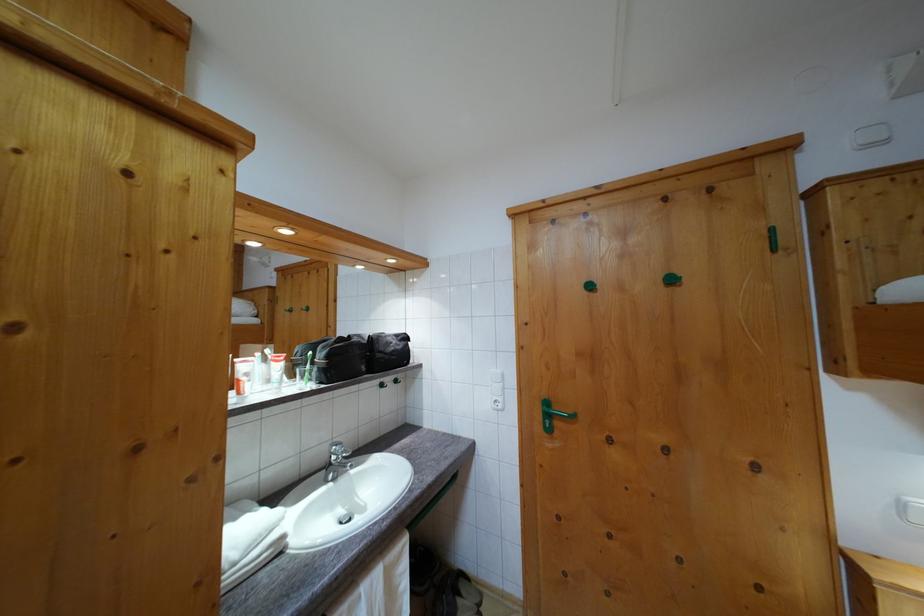
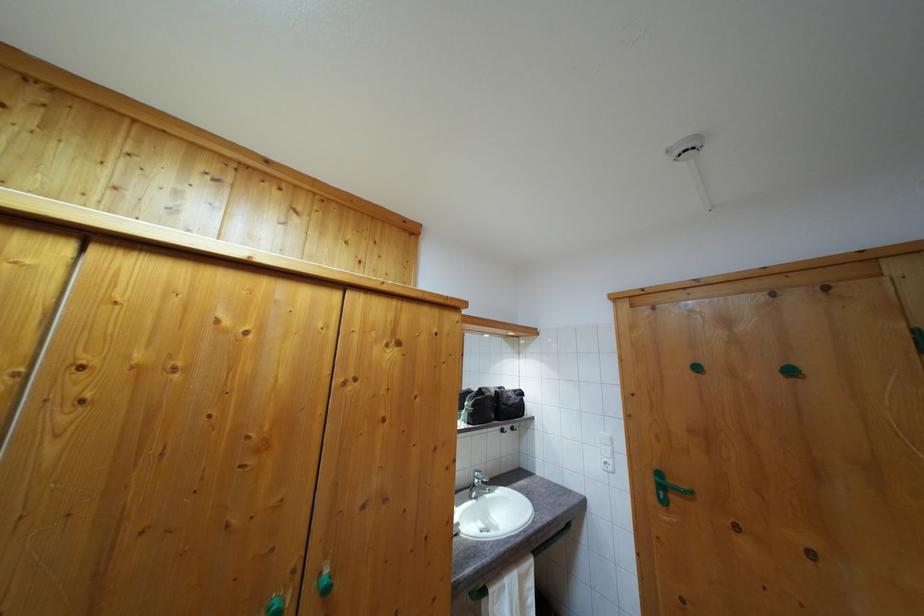
In the second image, find the point that corresponds to the point at 337,464 in the first image.

(480, 488)